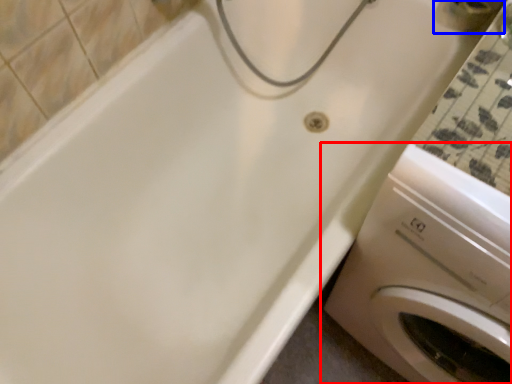
Question: Which object is closer to the camera taking this photo, washing machine (highlighted by a red box) or faucet (highlighted by a blue box)?

Choices:
 (A) washing machine
 (B) faucet

Answer: (A)